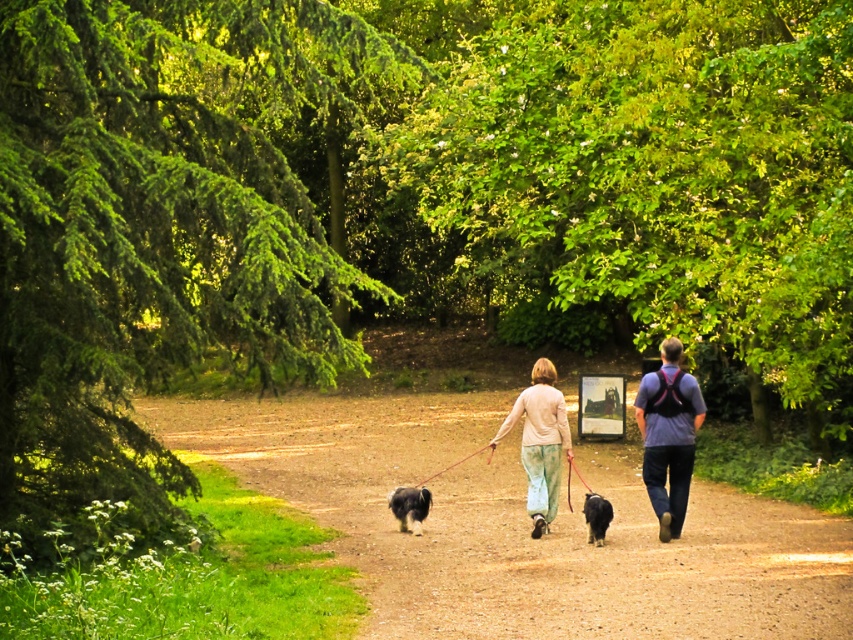
Question: Which point is farther to the camera?

Choices:
 (A) (401, 500)
 (B) (721, 508)

Answer: (B)

Question: Can you confirm if blue denim jeans at center is thinner than light beige sweater at center?

Choices:
 (A) yes
 (B) no

Answer: (A)

Question: Does fluffy black dog at center have a lesser width compared to black shaggy dog at center?

Choices:
 (A) yes
 (B) no

Answer: (B)

Question: Which is farther from the light beige sweater at center?

Choices:
 (A) soft black fur at center
 (B) black shaggy dog at center
 (C) matte blue shirt at center
 (D) dirt path at center

Answer: (D)

Question: Which of the following is the farthest from the observer?

Choices:
 (A) dirt path at center
 (B) fluffy black dog at center

Answer: (B)

Question: Does blue denim jeans at center have a smaller size compared to fluffy black dog at center?

Choices:
 (A) no
 (B) yes

Answer: (A)